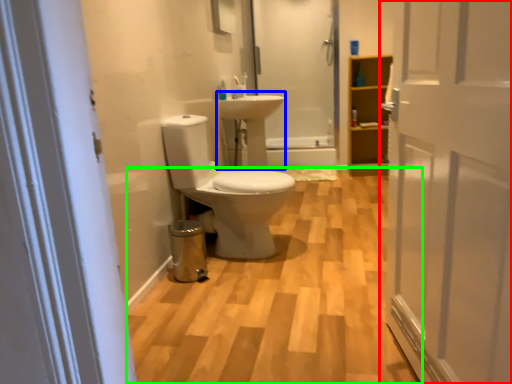
Question: Which object is positioned farthest from door (highlighted by a red box)? Select from sink (highlighted by a blue box) and plain (highlighted by a green box).

Choices:
 (A) sink
 (B) plain

Answer: (A)